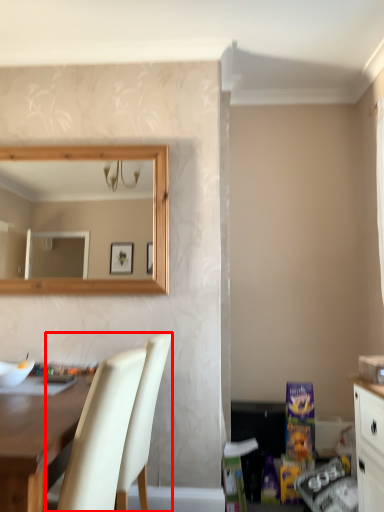
Question: From the image's perspective, where is chair (annotated by the red box) located relative to desk?

Choices:
 (A) above
 (B) below

Answer: (A)